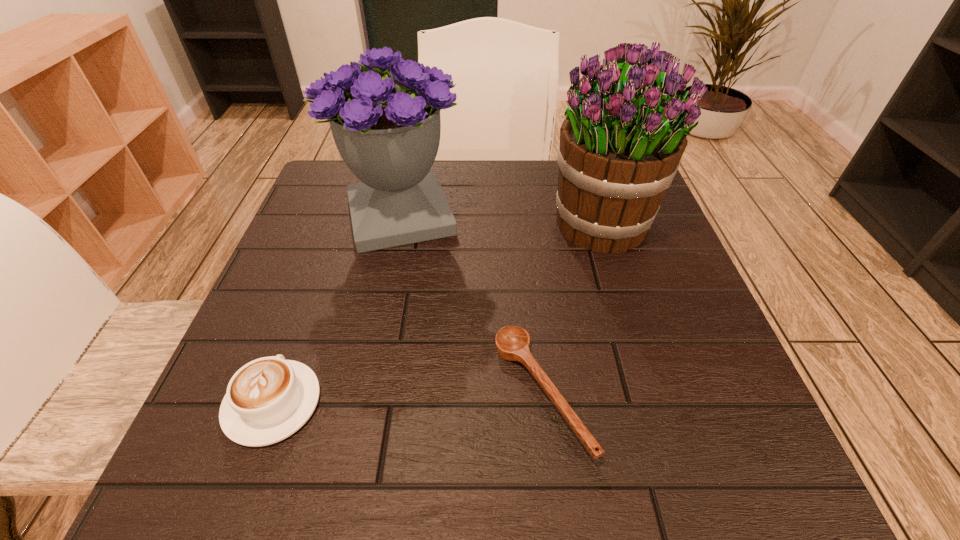
At what (x,y) coordinates should I click in order to perform the action: click on free space that satisfies the following two spatial constraints: 1. with the handle on the right side of the cappuccino; 2. on the right side of the right bouquet. Please return your answer as a coordinate pair (x, y). Looking at the image, I should click on (338, 225).

Identify the location of free location that satisfies the following two spatial constraints: 1. with the handle on the right side of the right bouquet; 2. on the left side of the cappuccino. (338, 225).

Find the location of a particular element. The image size is (960, 540). free region that satisfies the following two spatial constraints: 1. with the handle on the right side of the cappuccino; 2. on the right side of the left bouquet is located at coordinates (341, 216).

Locate an element on the screen. free spot that satisfies the following two spatial constraints: 1. on the back side of the right bouquet; 2. on the left side of the wooden spoon is located at coordinates (523, 225).